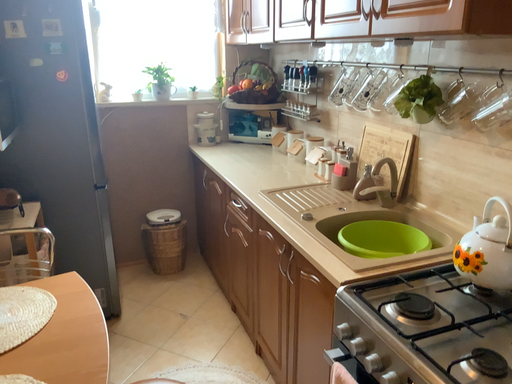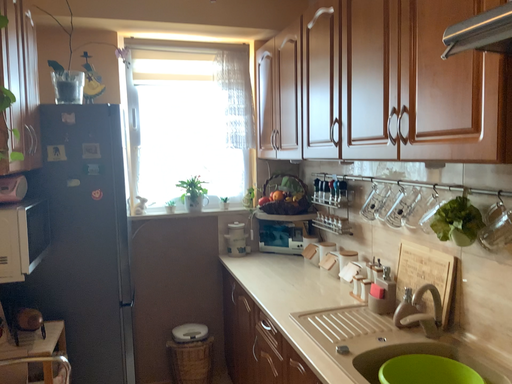
Question: Which way did the camera rotate in the video?

Choices:
 (A) rotated downward
 (B) rotated upward

Answer: (B)